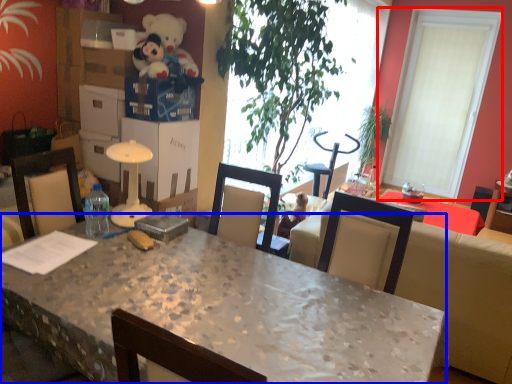
Question: Which point is further to the camera, window (highlighted by a red box) or desk (highlighted by a blue box)?

Choices:
 (A) window
 (B) desk

Answer: (A)